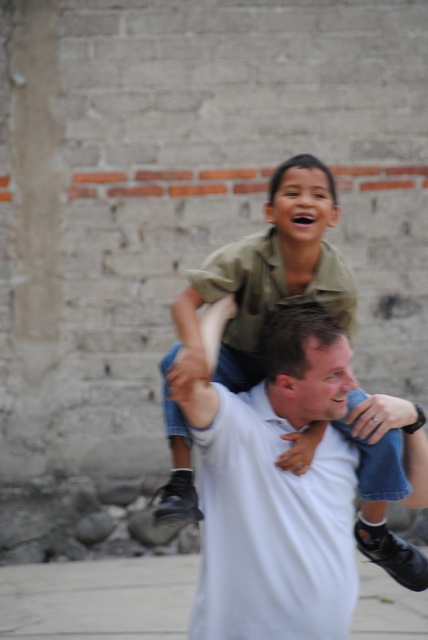
You are a photographer trying to capture the scene of the man and boy. You notice the white cotton shirt at center and the gray concrete pavement at lower center. Which object is wider in the image?

The white cotton shirt at center is wider than the gray concrete pavement at lower center.